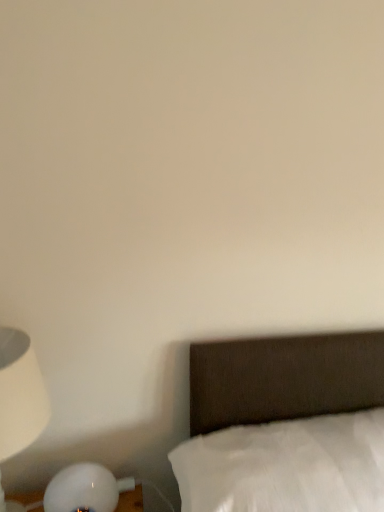
Question: Is white matte lamp at left far from white cotton bed at lower right?

Choices:
 (A) yes
 (B) no

Answer: (B)

Question: Does white matte lamp at left appear on the right side of white cotton bed at lower right?

Choices:
 (A) no
 (B) yes

Answer: (A)

Question: Is white matte lamp at left thinner than white cotton bed at lower right?

Choices:
 (A) yes
 (B) no

Answer: (A)

Question: From the image's perspective, is white matte lamp at left under white cotton bed at lower right?

Choices:
 (A) yes
 (B) no

Answer: (B)

Question: Can you confirm if white matte lamp at left is bigger than white cotton bed at lower right?

Choices:
 (A) yes
 (B) no

Answer: (B)

Question: From the image's perspective, does white matte lamp at left appear higher than white cotton bed at lower right?

Choices:
 (A) no
 (B) yes

Answer: (B)

Question: Can you confirm if white cotton bed at lower right is wider than white matte lamp at left?

Choices:
 (A) yes
 (B) no

Answer: (A)

Question: Is white cotton bed at lower right positioned beyond the bounds of white matte lamp at left?

Choices:
 (A) no
 (B) yes

Answer: (B)

Question: Is white cotton bed at lower right bigger than white matte lamp at left?

Choices:
 (A) no
 (B) yes

Answer: (B)

Question: Can you confirm if white cotton bed at lower right is thinner than white matte lamp at left?

Choices:
 (A) yes
 (B) no

Answer: (B)

Question: From a real-world perspective, is white cotton bed at lower right physically below white matte lamp at left?

Choices:
 (A) yes
 (B) no

Answer: (A)

Question: Is white cotton bed at lower right surrounding white matte lamp at left?

Choices:
 (A) no
 (B) yes

Answer: (A)

Question: Is white cotton bed at lower right taller or shorter than white matte lamp at left?

Choices:
 (A) short
 (B) tall

Answer: (A)